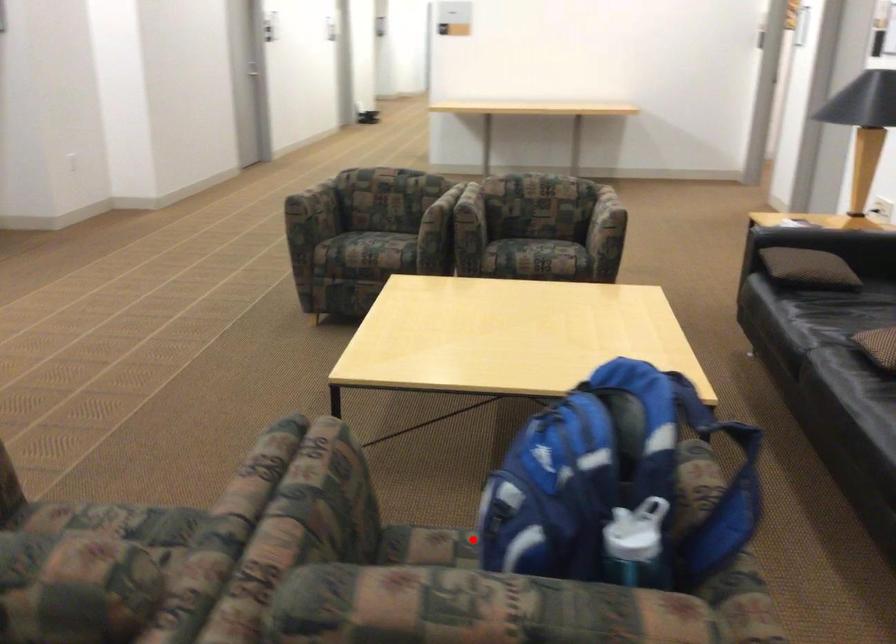
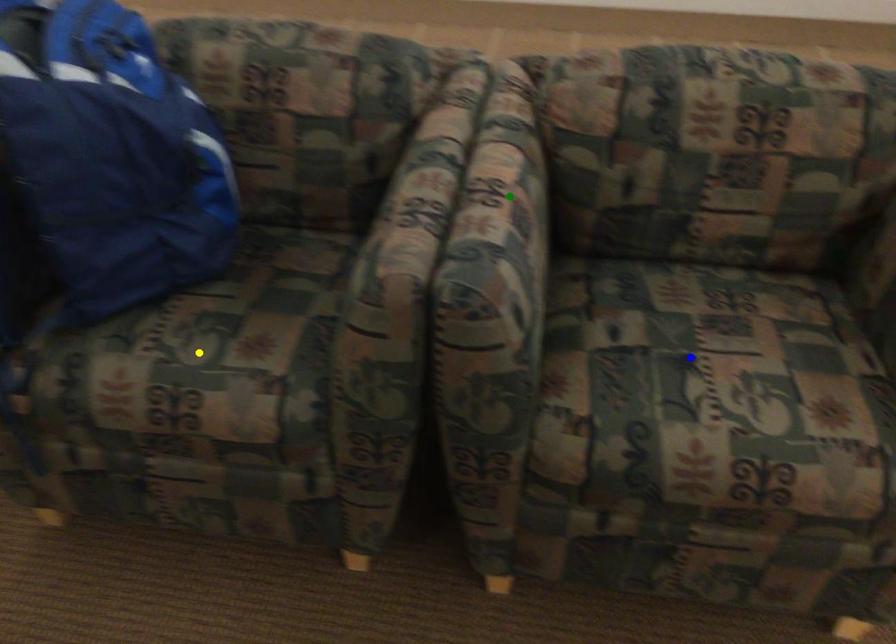
Question: I am providing you with two images of the same scene from different viewpoints. A red point is marked on the first image. You are given multiple points on the second image. Which point in image 2 is actually the same real-world point as the red point in image 1?

Choices:
 (A) blue point
 (B) green point
 (C) yellow point

Answer: (C)